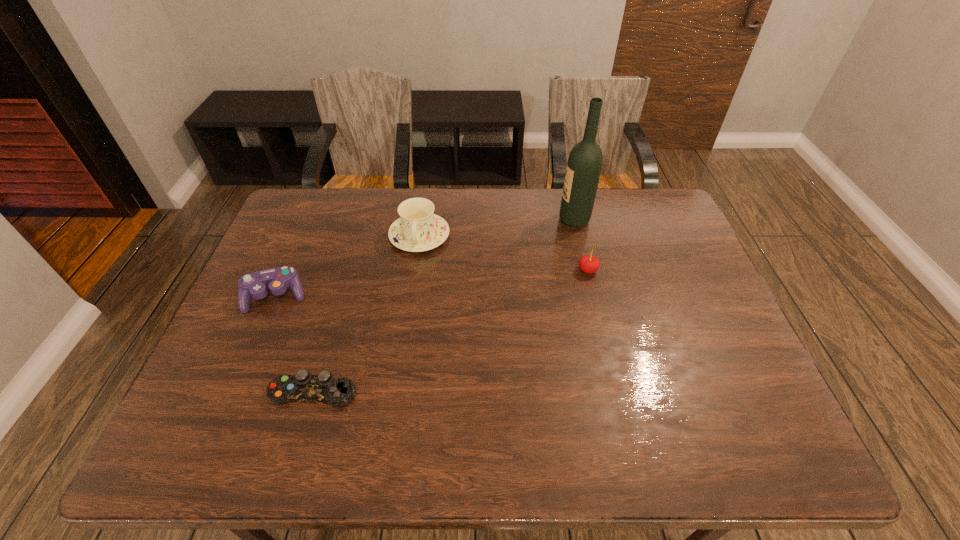
The width and height of the screenshot is (960, 540). In order to click on free point between the chinaware and the fourth tallest object in this screenshot , I will do `click(348, 266)`.

Locate an element on the screen. empty space that is in between the chinaware and the nearer control is located at coordinates (367, 314).

Identify which object is the fourth nearest to the tallest object. Please provide its 2D coordinates. Your answer should be formatted as a tuple, i.e. [(x, y)], where the tuple contains the x and y coordinates of a point satisfying the conditions above.

[(277, 280)]

Where is `the third closest object to the farther control`? the third closest object to the farther control is located at coordinates (589, 264).

Identify the location of free location that satisfies the following two spatial constraints: 1. on the labeled side of the wine bottle; 2. on the front side of the shortest object. The image size is (960, 540). (615, 393).

Where is `free space in the image that satisfies the following two spatial constraints: 1. on the back side of the third nearest object; 2. on the left side of the fourth farthest object`? The height and width of the screenshot is (540, 960). free space in the image that satisfies the following two spatial constraints: 1. on the back side of the third nearest object; 2. on the left side of the fourth farthest object is located at coordinates (287, 271).